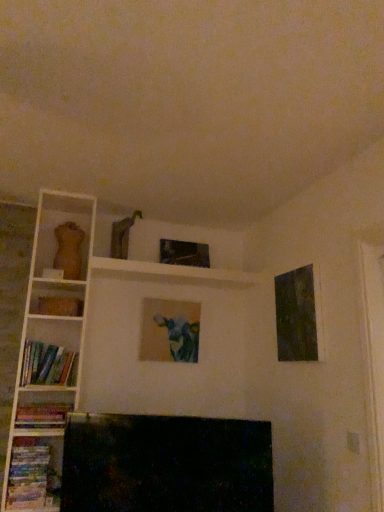
Question: In the image, is dark textured canvas at upper right, which is the 3th picture frame in back-to-front order, on the left side or the right side of hardcover books at left, the second book when ordered from bottom to top?

Choices:
 (A) right
 (B) left

Answer: (A)

Question: From a real-world perspective, is dark textured canvas at upper right, the first picture frame when ordered from front to back, physically located above or below hardcover books at left, positioned as the second book in top-to-bottom order?

Choices:
 (A) above
 (B) below

Answer: (A)

Question: Based on their relative distances, which object is nearer to the matte canvas painting at center, the 3th picture frame in the right-to-left sequence?

Choices:
 (A) hardcover book at left
 (B) hardcover books at left, the second book when ordered from bottom to top
 (C) hardcover books at lower left, which appears as the third book when viewed from the top
 (D) metallic glass picture frame at upper center, which ranks as the second picture frame in right-to-left order
 (E) dark textured canvas at upper right, acting as the third picture frame starting from the left

Answer: (D)

Question: Which object is positioned closest to the matte canvas painting at center, which appears as the 2th picture frame when viewed from the front?

Choices:
 (A) hardcover book at left
 (B) metallic glass picture frame at upper center, the 1th picture frame when ordered from back to front
 (C) hardcover books at left, positioned as the second book in top-to-bottom order
 (D) hardcover books at lower left, the first book from the bottom
 (E) hardcover books at left, the 3th book positioned from the bottom

Answer: (B)